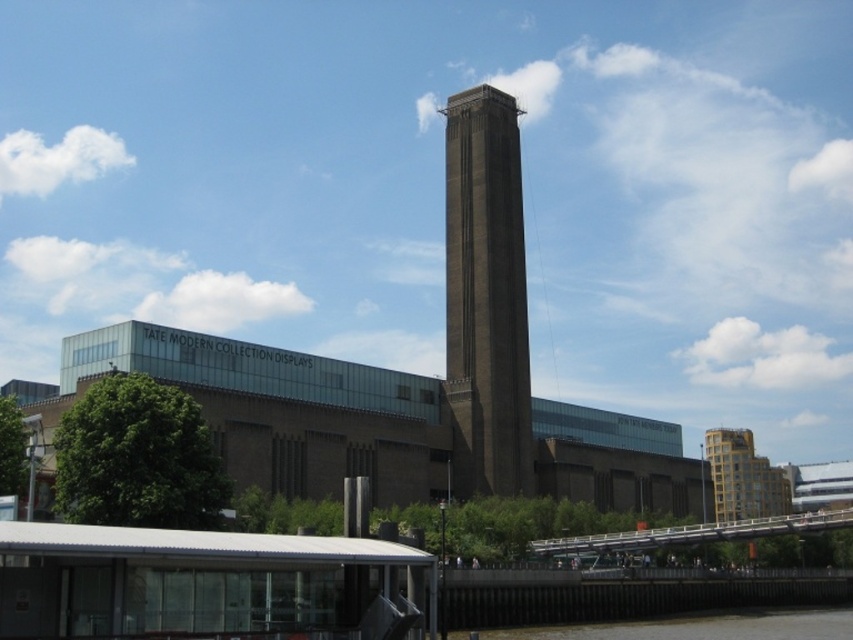
You are a photographer standing at a certain point. You want to take a photo of the brown stone tower at center from a distance that is exactly 100 meters away. Based on the scene description, can you achieve this?

The brown stone tower at center and camera are 96.75 meters apart, so you cannot achieve the desired distance of 100 meters. You are closer than required.

You are a tourist standing in front of the Tate Modern museum. You see the brown stone tower at center and the brown concrete river at lower center. Which object is closer to you?

The brown stone tower at center is closer to you because the brown concrete river at lower center is behind it.

You are an architect visiting the Tate Modern museum and want to compare the height of the brown stone tower at center and the brown concrete river at lower center. Which one is taller?

The brown stone tower at center is taller than the brown concrete river at lower center.